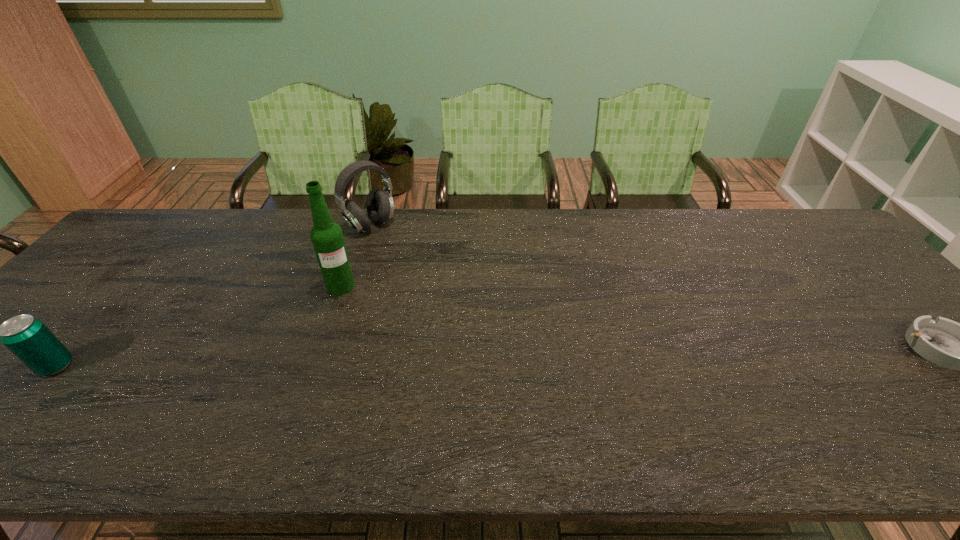
Choose which object is the nearest neighbor to the third tallest object. Please provide its 2D coordinates. Your answer should be formatted as a tuple, i.e. [(x, y)], where the tuple contains the x and y coordinates of a point satisfying the conditions above.

[(327, 238)]